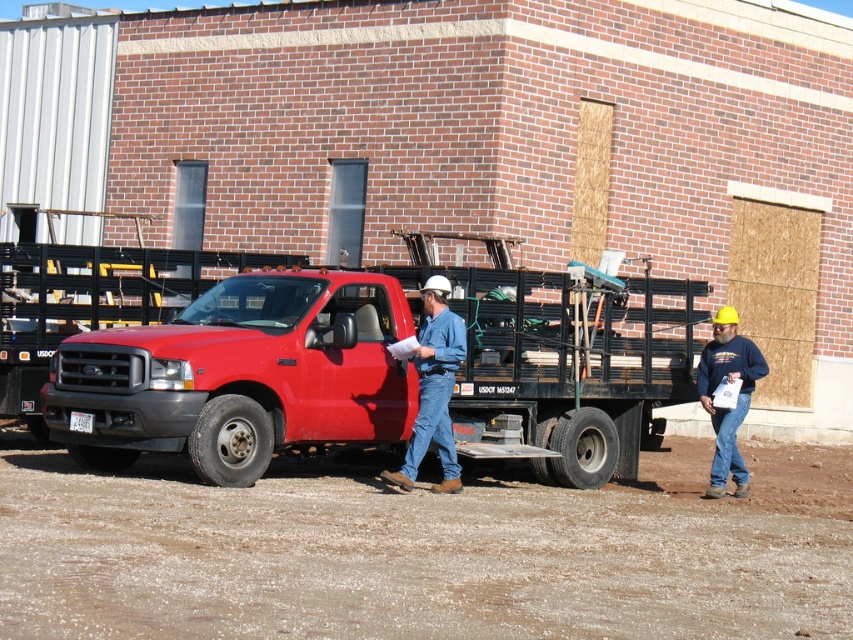
Question: Which object appears closest to the camera in this image?

Choices:
 (A) matte red truck at center
 (B) brown sandy dirt at lower center

Answer: (B)

Question: Can you confirm if brown sandy dirt at lower center is smaller than blue sweatshirt at right?

Choices:
 (A) yes
 (B) no

Answer: (B)

Question: Does brown sandy dirt at lower center appear on the left side of blue sweatshirt at right?

Choices:
 (A) yes
 (B) no

Answer: (A)

Question: Is matte red truck at center above blue sweatshirt at right?

Choices:
 (A) no
 (B) yes

Answer: (B)

Question: Among these objects, which one is nearest to the camera?

Choices:
 (A) brown sandy dirt at lower center
 (B) blue sweatshirt at right
 (C) matte blue jeans at center

Answer: (A)

Question: Which object appears closest to the camera in this image?

Choices:
 (A) matte blue jeans at center
 (B) matte red truck at center

Answer: (A)